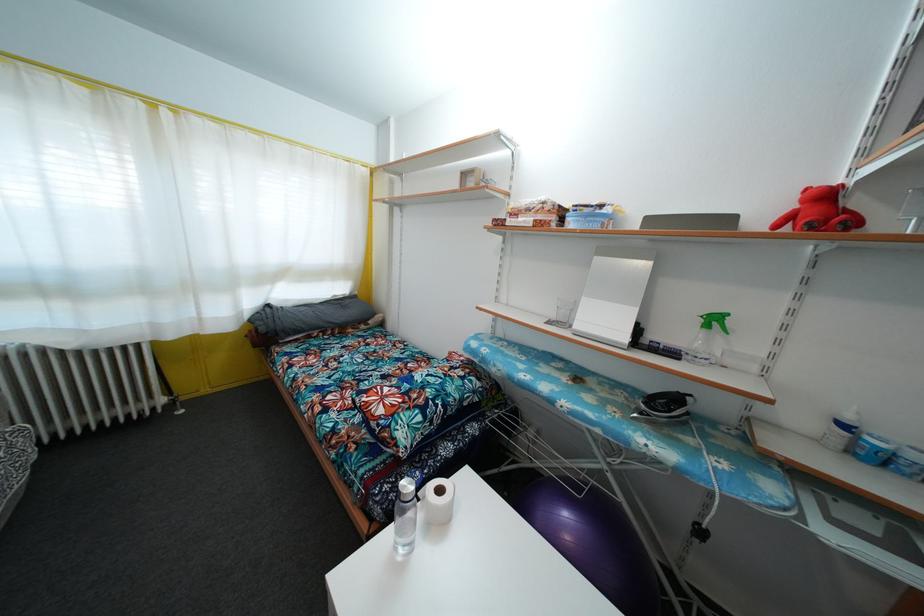
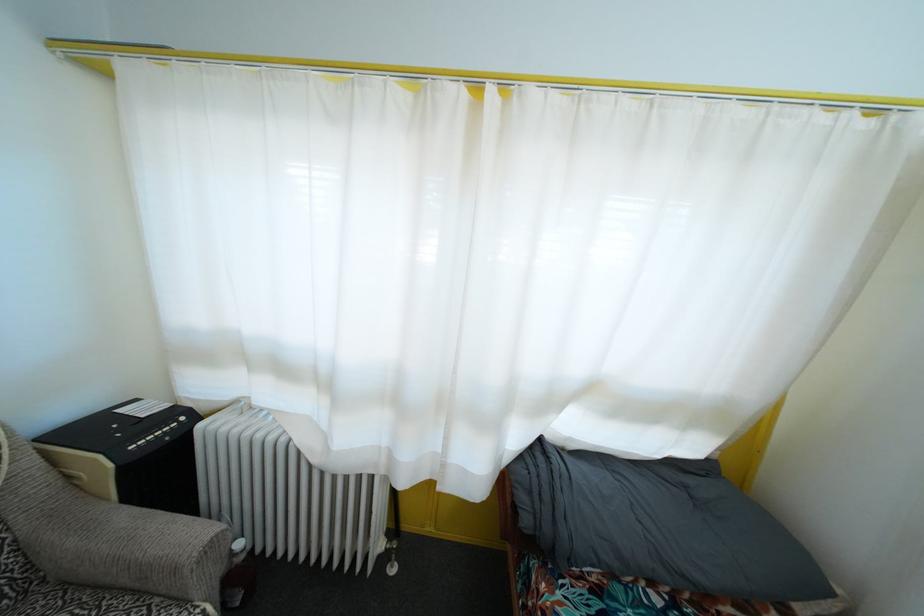
Locate, in the second image, the point that corresponds to point (265, 336) in the first image.

(529, 528)